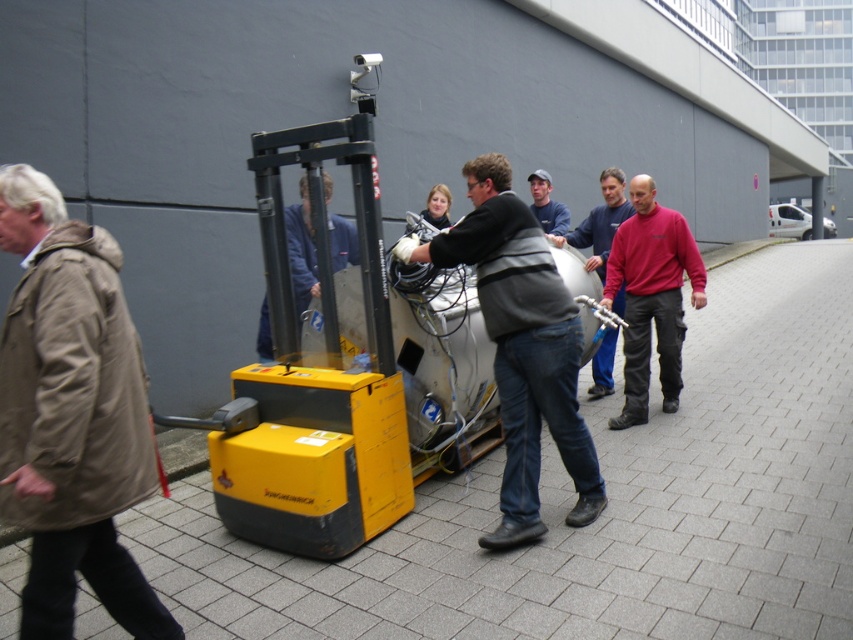
You are a safety inspector at the worksite. You notice two jackets left unattended on the ground at the center of the scene. The jackets are labeled as the red fleece jacket at center and the blue fabric jacket at center. According to safety protocols, only the taller jacket can be placed in the designated storage bin. Which jacket should you choose?

The red fleece jacket at center is taller than the blue fabric jacket at center, so you should choose the red fleece jacket at center to place in the designated storage bin.

You are a safety inspector at the worksite. You notice two pieces of clothing at the center of the scene, a red matte jacket and blue denim jeans. According to safety protocols, all workers must wear PPE that covers their torso and legs. Does the red matte jacket at center and blue denim jeans at center together meet the required coverage?

The red matte jacket at center is much taller as blue denim jeans at center. Since the red matte jacket at center covers the torso and the blue denim jeans at center covers the legs, together they meet the required coverage for PPE.